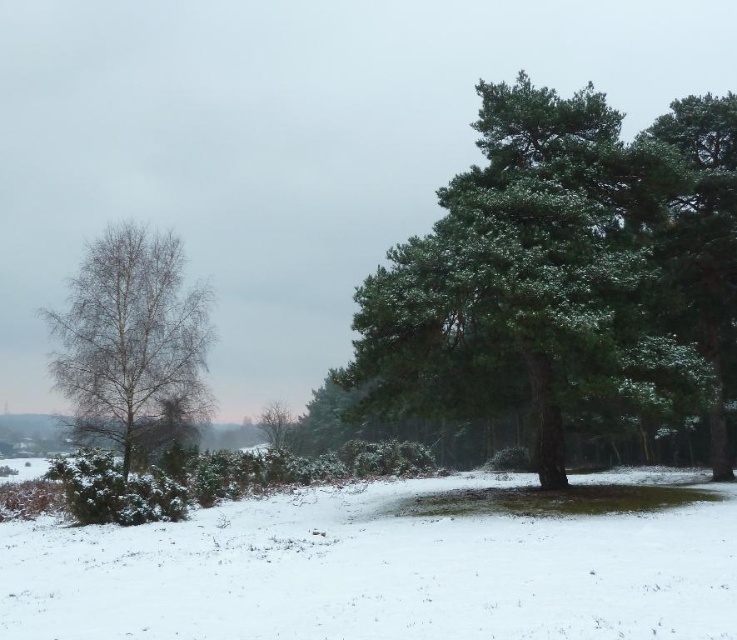
Question: Can you confirm if bare birch tree at left is positioned below green matte tree at center?

Choices:
 (A) no
 (B) yes

Answer: (A)

Question: From the image, what is the correct spatial relationship of bare birch tree at left in relation to green textured tree at right?

Choices:
 (A) left
 (B) right

Answer: (A)

Question: Observing the image, what is the correct spatial positioning of green textured tree at right in reference to green matte tree at center?

Choices:
 (A) above
 (B) below

Answer: (A)

Question: Which point is farther from the camera taking this photo?

Choices:
 (A) (545, 131)
 (B) (259, 428)
 (C) (167, 282)

Answer: (B)

Question: Which object appears closest to the camera in this image?

Choices:
 (A) green textured tree at center
 (B) green textured tree at right

Answer: (A)

Question: Which point is closer to the camera?

Choices:
 (A) green textured tree at right
 (B) green textured tree at center
 (C) bare birch tree at left
 (D) green matte tree at center

Answer: (B)